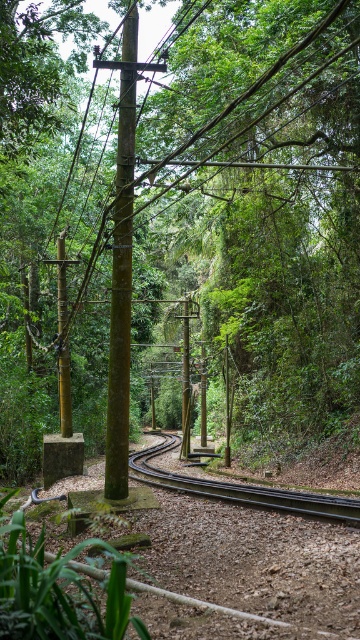
Describe the element at coordinates (240, 490) in the screenshot. This screenshot has width=360, height=640. I see `black metal train track at center` at that location.

Based on the photo, is black metal train track at center smaller than green bamboo pole at center?

No, black metal train track at center is not smaller than green bamboo pole at center.

Between point (137, 476) and point (65, 349), which one is positioned behind?

The point (137, 476) is more distant.

The height and width of the screenshot is (640, 360). What are the coordinates of `black metal train track at center` in the screenshot? It's located at (240, 490).

Does brown wooden telegraph pole at center appear on the left side of black metal train track at center?

No, brown wooden telegraph pole at center is not to the left of black metal train track at center.

Which is in front, point (113, 481) or point (308, 512)?

Point (113, 481)

Where is `brown wooden telegraph pole at center`? The image size is (360, 640). brown wooden telegraph pole at center is located at coordinates (122, 273).

Find the location of a particular element. The width and height of the screenshot is (360, 640). brown wooden telegraph pole at center is located at coordinates (122, 273).

Is black metal train track at center shorter than green mossy pole at center?

Yes.

Describe the element at coordinates (240, 490) in the screenshot. The width and height of the screenshot is (360, 640). I see `black metal train track at center` at that location.

Where is `black metal train track at center`? The height and width of the screenshot is (640, 360). black metal train track at center is located at coordinates (240, 490).